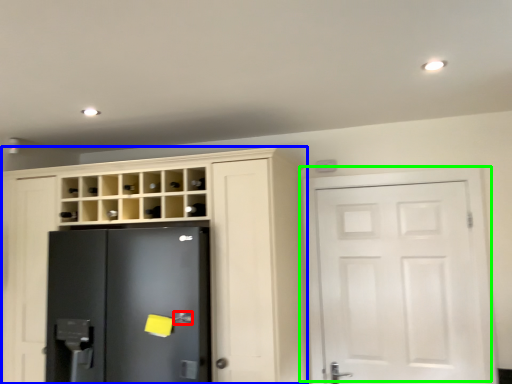
Question: Based on their relative distances, which object is nearer to door handle (highlighted by a red box)? Choose from cupboard (highlighted by a blue box) and door (highlighted by a green box).

Choices:
 (A) cupboard
 (B) door

Answer: (A)